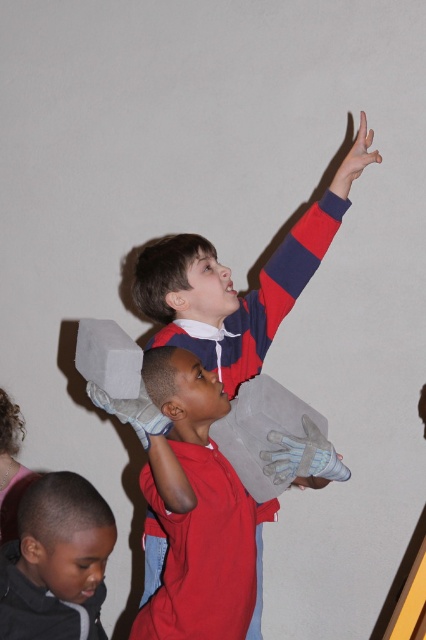
Is the position of matte red and blue striped sleeve at upper right more distant than that of white mesh glove at upper right?

Yes.

Between point (319, 241) and point (293, 456), which one is positioned behind?

Point (319, 241)

Who is more forward, (271, 266) or (333, 461)?

Positioned in front is point (333, 461).

Where is `matte red and blue striped sleeve at upper right`? Image resolution: width=426 pixels, height=640 pixels. matte red and blue striped sleeve at upper right is located at coordinates (307, 241).

Does matte red and blue striped sleeve at upper right lie behind smooth skin hand at upper right?

That is True.

You are a GUI agent. You are given a task and a screenshot of the screen. Output one action in this format:
    pyautogui.click(x=<x>, y=<y>)
    Task: Click on the matte red and blue striped sleeve at upper right
    The height and width of the screenshot is (640, 426).
    Given the screenshot: What is the action you would take?
    pyautogui.click(x=307, y=241)

Who is more forward, (333, 182) or (340, 170)?

Positioned in front is point (340, 170).

Identify the location of matte red and blue striped sleeve at upper right. The width and height of the screenshot is (426, 640). (307, 241).

Can you confirm if black matte jacket at lower left is positioned to the left of white mesh glove at upper right?

Correct, you'll find black matte jacket at lower left to the left of white mesh glove at upper right.

Who is higher up, black matte jacket at lower left or white mesh glove at upper right?

white mesh glove at upper right

Who is more forward, (92, 488) or (284, 474)?

Point (92, 488) is in front.

Find the location of a particular element. Image resolution: width=426 pixels, height=640 pixels. black matte jacket at lower left is located at coordinates (57, 561).